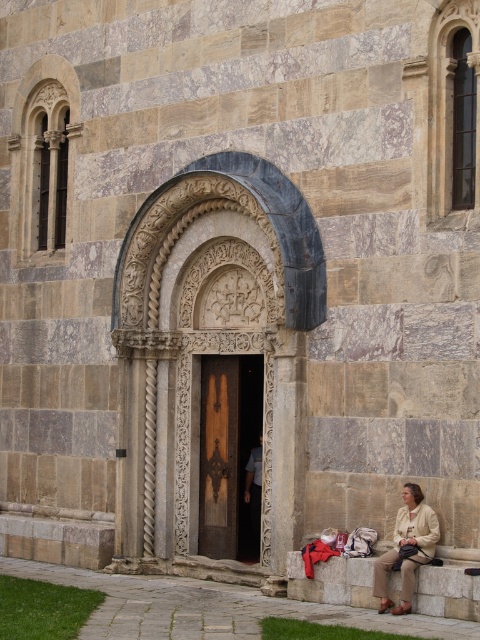
Between beige fabric jacket at lower right and dark brown wood door at center, which one is positioned higher?

beige fabric jacket at lower right

You are a GUI agent. You are given a task and a screenshot of the screen. Output one action in this format:
    pyautogui.click(x=<x>, y=<y>)
    Task: Click on the beige fabric jacket at lower right
    Image resolution: width=480 pixels, height=640 pixels.
    Given the screenshot: What is the action you would take?
    [x=407, y=545]